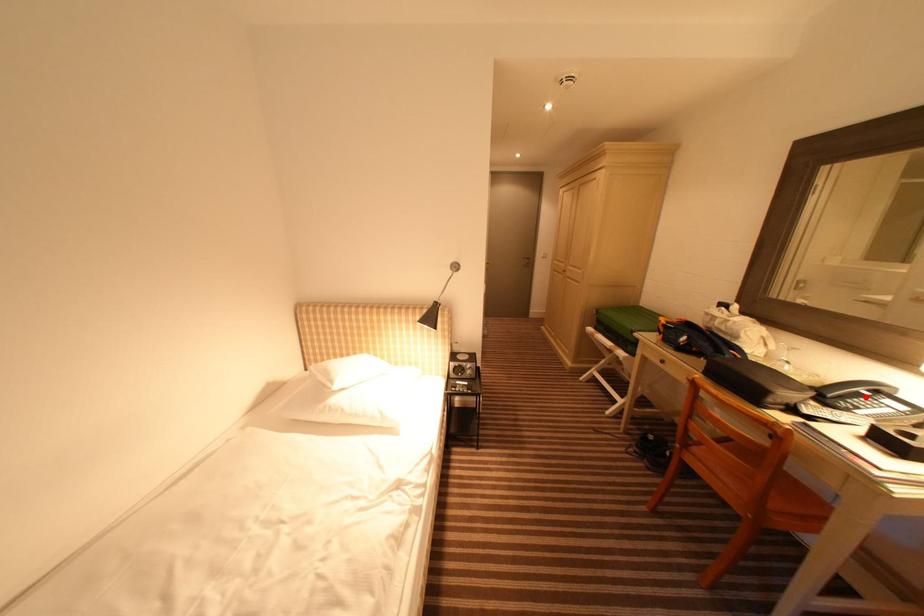
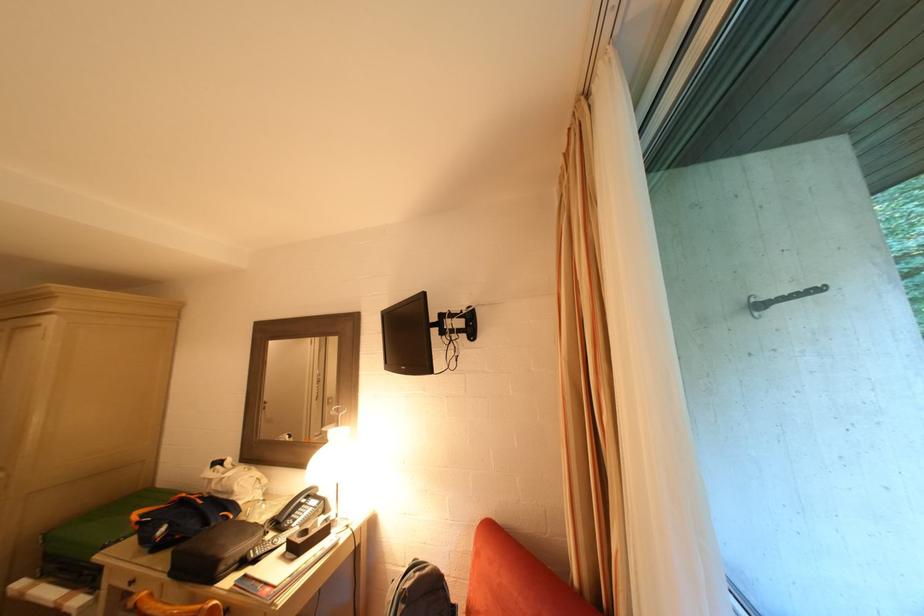
In the second image, find the point that corresponds to the highlighted location in the first image.

(306, 508)